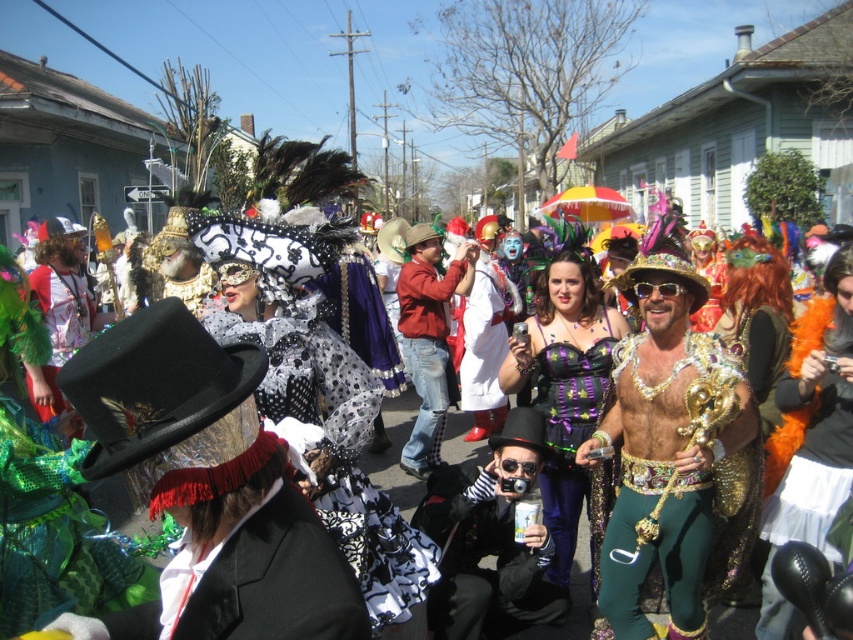
You are a photographer standing in the middle of the street during the parade. You want to capture a photo of the black velvet top hat at center and the red denim jeans at center. Based on their positions, which object will appear closer to the camera in your photo?

The black velvet top hat at center is in front of the red denim jeans at center, so it will appear closer to the camera in the photo.

You are a photographer standing at point 0.0, 0.0 in the image coordinate system. You want to capture a photo of the orange feather boa at center located at point [810,435]. What direction should you move to get closer to the orange feather boa at center?

To get closer to the orange feather boa at center located at point [810,435], you should move in the positive x and positive y direction since the boa is at higher x and y coordinates compared to your current position at 0.0, 0.0.